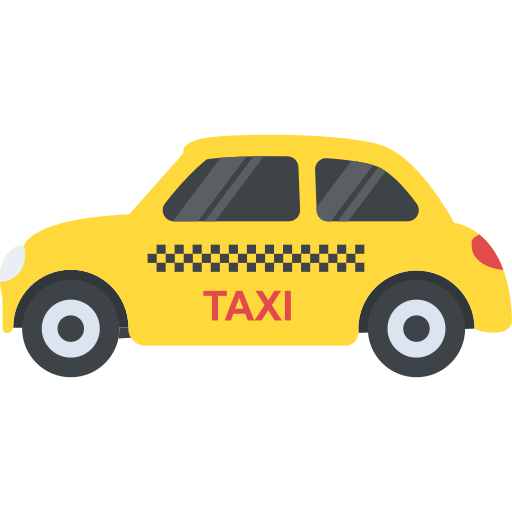
Identify the location of window streak. Image resolution: width=512 pixels, height=512 pixels. (218, 182), (335, 193).